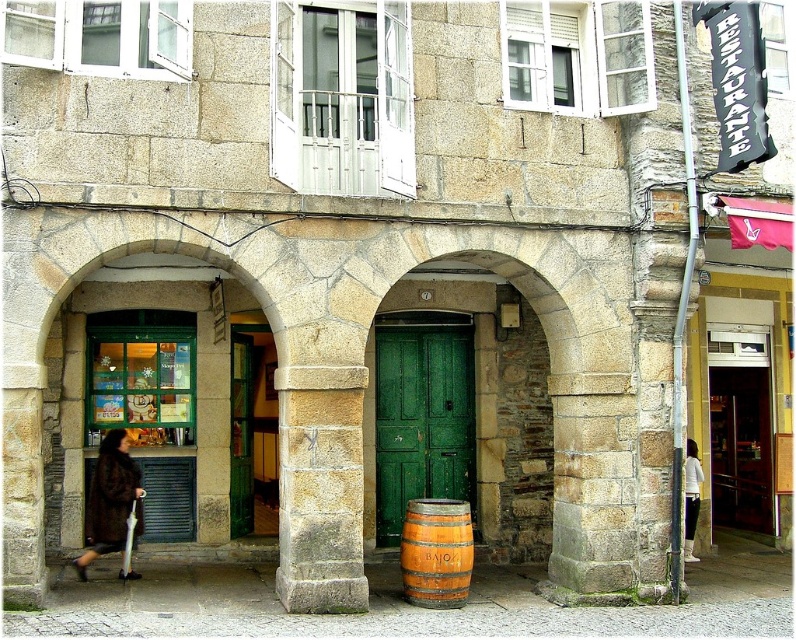
Question: Estimate the real-world distances between objects in this image. Which object is farther from the orange wooden barrel at center?

Choices:
 (A) brown fur coat at lower left
 (B) green wooden door at center

Answer: (A)

Question: Does green wooden door at center appear over white fabric pants at right?

Choices:
 (A) yes
 (B) no

Answer: (A)

Question: Is green wooden door at center thinner than white fabric pants at right?

Choices:
 (A) no
 (B) yes

Answer: (A)

Question: Does green wooden door at center appear under orange wooden barrel at center?

Choices:
 (A) no
 (B) yes

Answer: (A)

Question: Which object is closer to the camera taking this photo?

Choices:
 (A) white fabric pants at right
 (B) orange wooden barrel at center
 (C) green wooden door at center
 (D) brown fur coat at lower left

Answer: (B)

Question: Based on their relative distances, which object is farther from the orange wooden barrel at center?

Choices:
 (A) brown fur coat at lower left
 (B) white fabric pants at right

Answer: (B)